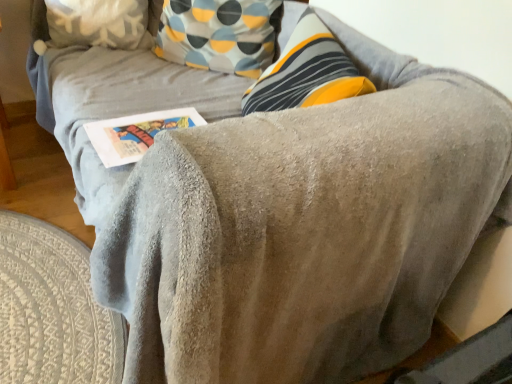
Question: Considering the positions of fluffy white pillow at upper left and white paper at center in the image, is fluffy white pillow at upper left wider or thinner than white paper at center?

Choices:
 (A) wide
 (B) thin

Answer: (B)

Question: From the image's perspective, is fluffy white pillow at upper left above or below white paper at center?

Choices:
 (A) below
 (B) above

Answer: (B)

Question: Is point (104, 24) closer or farther from the camera than point (104, 150)?

Choices:
 (A) farther
 (B) closer

Answer: (A)

Question: Would you say white paper at center is to the left or to the right of fluffy white pillow at upper left in the picture?

Choices:
 (A) left
 (B) right

Answer: (B)

Question: Would you say white paper at center is inside or outside fluffy white pillow at upper left?

Choices:
 (A) inside
 (B) outside

Answer: (B)

Question: In terms of height, does white paper at center look taller or shorter compared to fluffy white pillow at upper left?

Choices:
 (A) tall
 (B) short

Answer: (B)

Question: Is point (137, 148) closer or farther from the camera than point (53, 3)?

Choices:
 (A) closer
 (B) farther

Answer: (A)